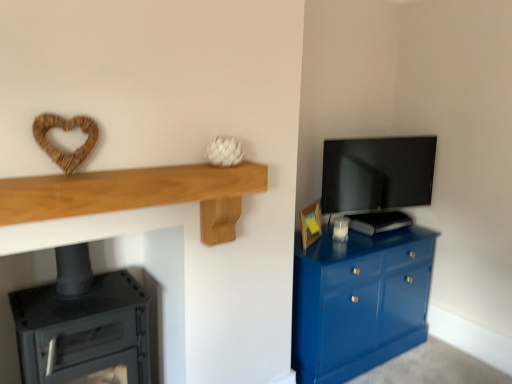
Question: In the image, is light oak wood shelf at upper left on the left side or the right side of glossy blue cabinet at right?

Choices:
 (A) right
 (B) left

Answer: (B)

Question: From the image's perspective, relative to glossy blue cabinet at right, is light oak wood shelf at upper left above or below?

Choices:
 (A) above
 (B) below

Answer: (A)

Question: Which object is the farthest from the black matte stove at lower left?

Choices:
 (A) glossy blue cabinet at right
 (B) matte black tv at upper right
 (C) wooden picture frame at right
 (D) light oak wood shelf at upper left

Answer: (B)

Question: Which of these objects is positioned closest to the glossy blue cabinet at right?

Choices:
 (A) black matte stove at lower left
 (B) wooden picture frame at right
 (C) light oak wood shelf at upper left
 (D) matte black tv at upper right

Answer: (B)